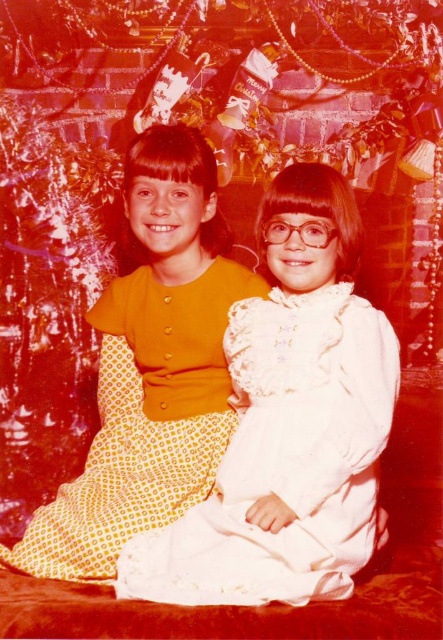
Question: Is white lace dress at center positioned behind yellow dotted dress at center?

Choices:
 (A) no
 (B) yes

Answer: (A)

Question: Is white lace dress at center wider than yellow dotted dress at center?

Choices:
 (A) no
 (B) yes

Answer: (A)

Question: Which point appears closest to the camera in this image?

Choices:
 (A) (256, 536)
 (B) (96, 545)

Answer: (A)

Question: Which object appears farthest from the camera in this image?

Choices:
 (A) yellow dotted dress at center
 (B) white lace dress at center

Answer: (A)

Question: Is white lace dress at center smaller than yellow dotted dress at center?

Choices:
 (A) yes
 (B) no

Answer: (A)